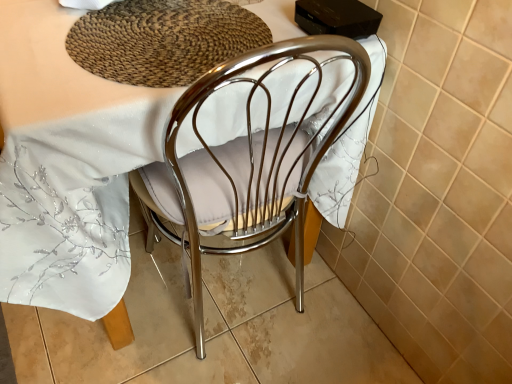
At what (x,y) coordinates should I click in order to perform the action: click on empty space that is ontop of polished chrome chair at center (from a real-world perspective). Please return your answer as a coordinate pair (x, y). The image size is (512, 384). Looking at the image, I should click on (145, 26).